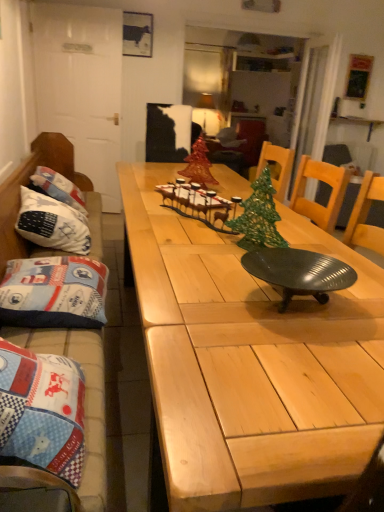
The height and width of the screenshot is (512, 384). I want to click on free space to the left of green metallic christmas tree at center, acting as the 2th christmas tree starting from the top, so click(203, 246).